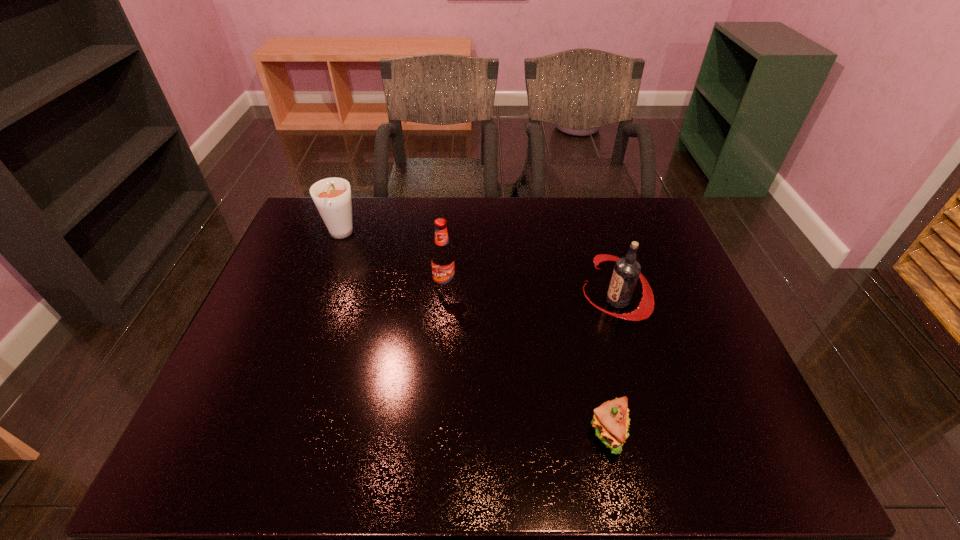
Where is `vacant area at the right edge of the desktop`? vacant area at the right edge of the desktop is located at coordinates (723, 350).

This screenshot has width=960, height=540. Find the location of `vacant space at the far left corner`. vacant space at the far left corner is located at coordinates (352, 201).

You are a GUI agent. You are given a task and a screenshot of the screen. Output one action in this format:
    pyautogui.click(x=<x>, y=<y>)
    Task: Click on the empty location between the third object from right to left and the leftmost object
    The height and width of the screenshot is (540, 960).
    Given the screenshot: What is the action you would take?
    pyautogui.click(x=393, y=261)

What are the coordinates of `free spot between the shortest object and the second object from left to right` in the screenshot? It's located at (527, 360).

The height and width of the screenshot is (540, 960). Identify the location of vacant space that is in between the rightmost root beer and the third object from right to left. (531, 294).

At what (x,y) coordinates should I click in order to perform the action: click on empty space that is in between the rightmost root beer and the nearest object. Please return your answer as a coordinate pair (x, y). The height and width of the screenshot is (540, 960). Looking at the image, I should click on (612, 366).

The height and width of the screenshot is (540, 960). Find the location of `free space between the shortest object and the rightmost root beer`. free space between the shortest object and the rightmost root beer is located at coordinates (612, 366).

This screenshot has width=960, height=540. In order to click on vacant area between the leftmost object and the shortest object in this screenshot , I will do `click(474, 334)`.

Find the location of a particular element. Image resolution: width=960 pixels, height=540 pixels. vacant area that lies between the rightmost root beer and the sandwich is located at coordinates (612, 366).

This screenshot has width=960, height=540. What are the coordinates of `vacant area between the rightmost root beer and the sandwich` in the screenshot? It's located at (612, 366).